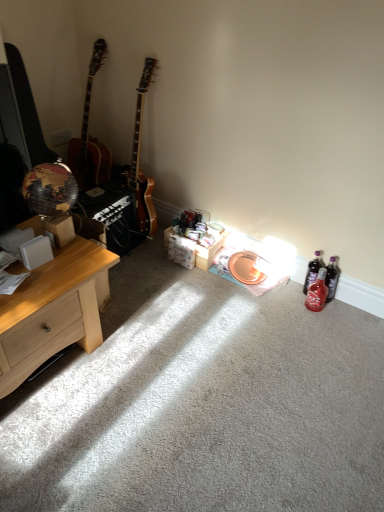
Question: Considering the positions of translucent red glass bottle at lower right, acting as the 2th bottle starting from the back, and translucent purple bottle at lower right, which appears as the first bottle when viewed from the back, in the image, is translucent red glass bottle at lower right, acting as the 2th bottle starting from the back, taller or shorter than translucent purple bottle at lower right, which appears as the first bottle when viewed from the back,?

Choices:
 (A) tall
 (B) short

Answer: (B)

Question: Based on their sizes in the image, would you say translucent red glass bottle at lower right, the first bottle viewed from the front, is bigger or smaller than translucent purple bottle at lower right, which is the 2th bottle in front-to-back order?

Choices:
 (A) big
 (B) small

Answer: (A)

Question: Estimate the real-world distances between objects in this image. Which object is farther from the light wood desk at left?

Choices:
 (A) translucent red glass bottle at lower right, acting as the 2th bottle starting from the back
 (B) translucent purple bottle at lower right, which is the 2th bottle in front-to-back order
 (C) white cardboard box at center

Answer: (B)

Question: Which is nearer to the translucent purple bottle at lower right, which appears as the first bottle when viewed from the back?

Choices:
 (A) white cardboard box at center
 (B) translucent red glass bottle at lower right, acting as the 2th bottle starting from the back
 (C) light wood desk at left

Answer: (B)